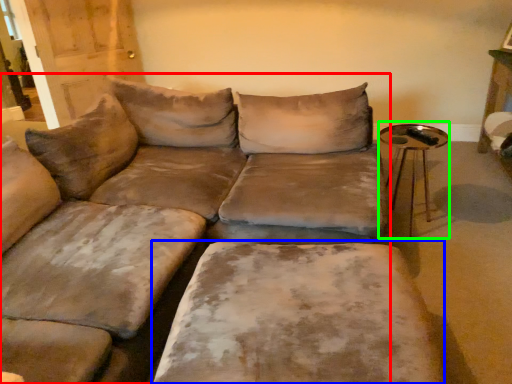
Question: Which object is positioned closest to studio couch (highlighted by a red box)? Select from wide (highlighted by a blue box) and side table (highlighted by a green box).

Choices:
 (A) wide
 (B) side table

Answer: (A)